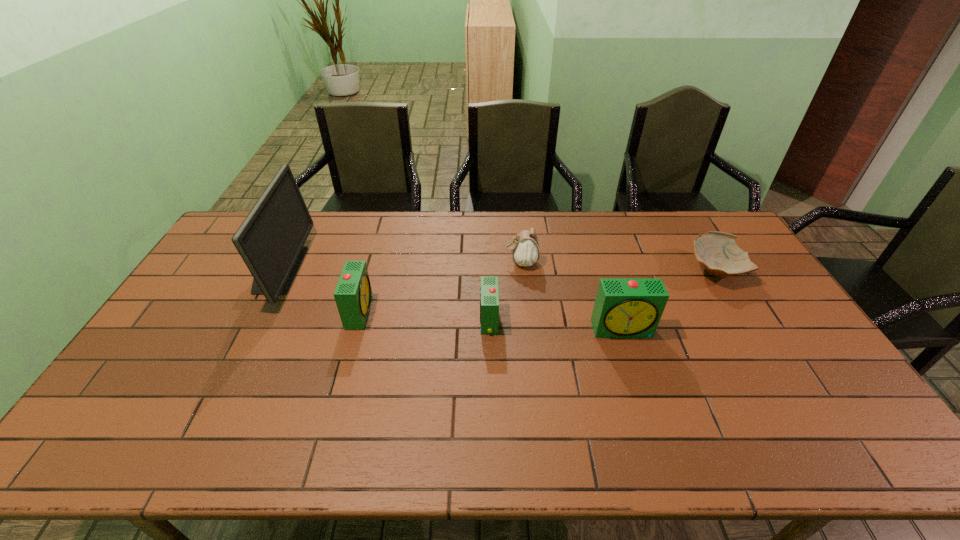
The width and height of the screenshot is (960, 540). In order to click on vacant space located 0.160m on the front-facing side of the leftmost alarm clock in this screenshot , I will do `click(422, 311)`.

Where is `free region located 0.160m on the front-facing side of the fourth object from right to left`? Image resolution: width=960 pixels, height=540 pixels. free region located 0.160m on the front-facing side of the fourth object from right to left is located at coordinates (426, 320).

You are a GUI agent. You are given a task and a screenshot of the screen. Output one action in this format:
    pyautogui.click(x=<x>, y=<y>)
    Task: Click on the free region located on the front-facing side of the fourth object from right to left
    The image size is (960, 540).
    Given the screenshot: What is the action you would take?
    pyautogui.click(x=399, y=320)

The width and height of the screenshot is (960, 540). I want to click on vacant space located on the front-facing side of the fourth object from right to left, so click(403, 320).

I want to click on free spot located on the front-facing side of the rightmost alarm clock, so click(645, 400).

The width and height of the screenshot is (960, 540). I want to click on free space located 0.330m on the screen side of the computer monitor, so click(x=398, y=269).

Find the location of a particular element. This screenshot has width=960, height=540. free spot located 0.130m on the front of the pottery is located at coordinates (746, 321).

Locate an element on the screen. The height and width of the screenshot is (540, 960). vacant space situated on the front-facing side of the pouch is located at coordinates (439, 262).

What are the coordinates of `vacant point located on the front-facing side of the pouch` in the screenshot? It's located at (398, 262).

At what (x,y) coordinates should I click in order to perform the action: click on free space located on the front-facing side of the pouch. Please return your answer as a coordinate pair (x, y). The image size is (960, 540). Looking at the image, I should click on (477, 262).